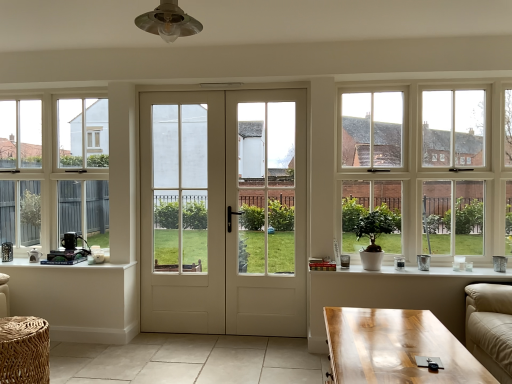
This screenshot has height=384, width=512. In order to click on vacant area that is in front of white smooth door at center in this screenshot , I will do `click(229, 356)`.